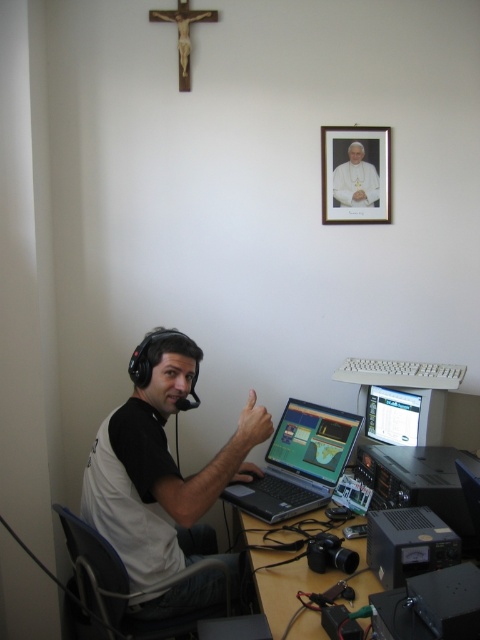
Question: Considering the real-world distances, which object is closest to the white cotton shirt at center?

Choices:
 (A) black plastic computer desk at lower center
 (B) matte black monitor at center
 (C) silver/black laptop at center
 (D) white paper portrait at upper center

Answer: (A)

Question: Which is nearer to the white paper portrait at upper center?

Choices:
 (A) white cotton shirt at center
 (B) matte black monitor at center
 (C) silver/black laptop at center

Answer: (B)

Question: Can you confirm if black plastic computer desk at lower center is positioned to the left of matte black monitor at center?

Choices:
 (A) yes
 (B) no

Answer: (A)

Question: Which object is the farthest from the white cotton shirt at center?

Choices:
 (A) silver/black laptop at center
 (B) white paper portrait at upper center
 (C) black plastic computer desk at lower center
 (D) matte black monitor at center

Answer: (B)

Question: Where is silver/black laptop at center located in relation to white paper portrait at upper center in the image?

Choices:
 (A) left
 (B) right

Answer: (A)

Question: Can you confirm if white cotton shirt at center is positioned above matte black monitor at center?

Choices:
 (A) yes
 (B) no

Answer: (B)